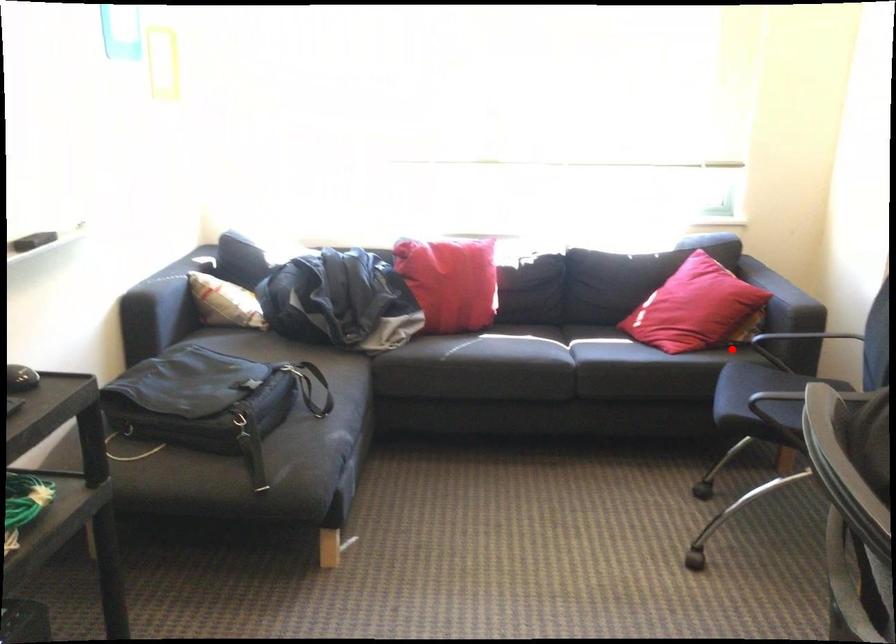
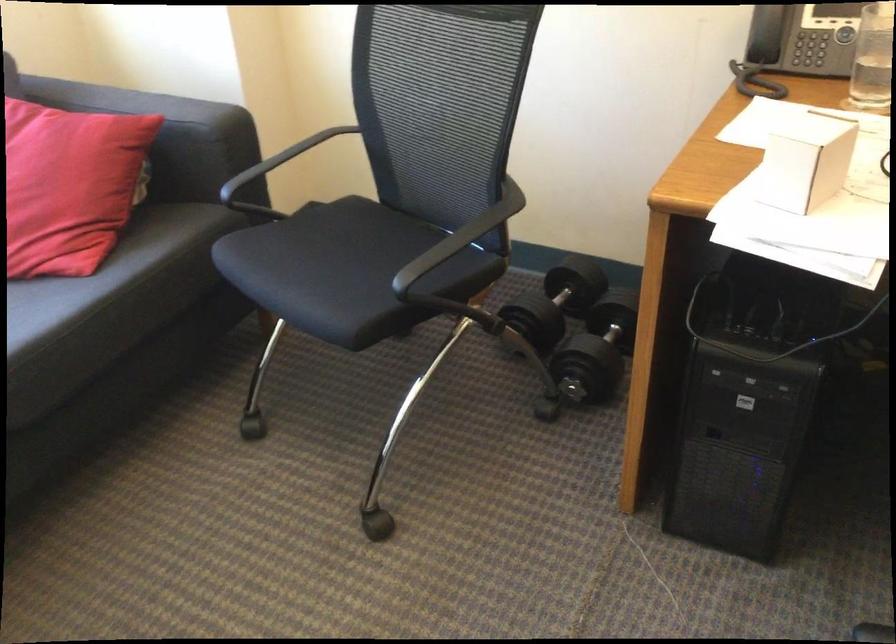
Question: I am providing you with two images of the same scene from different viewpoints. A red point is shown in image1. For the corresponding object point in image2, is it positioned nearer or farther from the camera?

Choices:
 (A) Nearer
 (B) Farther

Answer: (A)